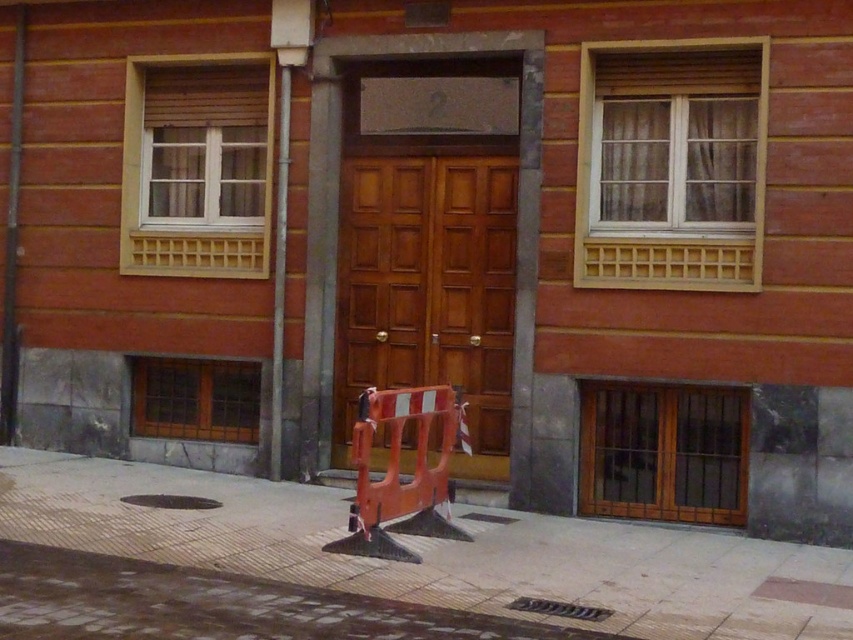
Question: Among these points, which one is nearest to the camera?

Choices:
 (A) (341, 401)
 (B) (405, 499)

Answer: (B)

Question: Can you confirm if wooden at center is positioned to the left of orange plastic barricade at center?

Choices:
 (A) yes
 (B) no

Answer: (B)

Question: Can you confirm if smooth concrete pavement at center is positioned below metallic gray pole at left?

Choices:
 (A) yes
 (B) no

Answer: (A)

Question: Among these points, which one is farthest from the camera?

Choices:
 (A) (287, 170)
 (B) (630, 529)

Answer: (A)

Question: Can you confirm if wooden at center is positioned below orange plastic barricade at center?

Choices:
 (A) no
 (B) yes

Answer: (A)

Question: Which of the following is the closest to the observer?

Choices:
 (A) pos(99,490)
 (B) pos(372,365)
 (C) pos(440,448)

Answer: (A)